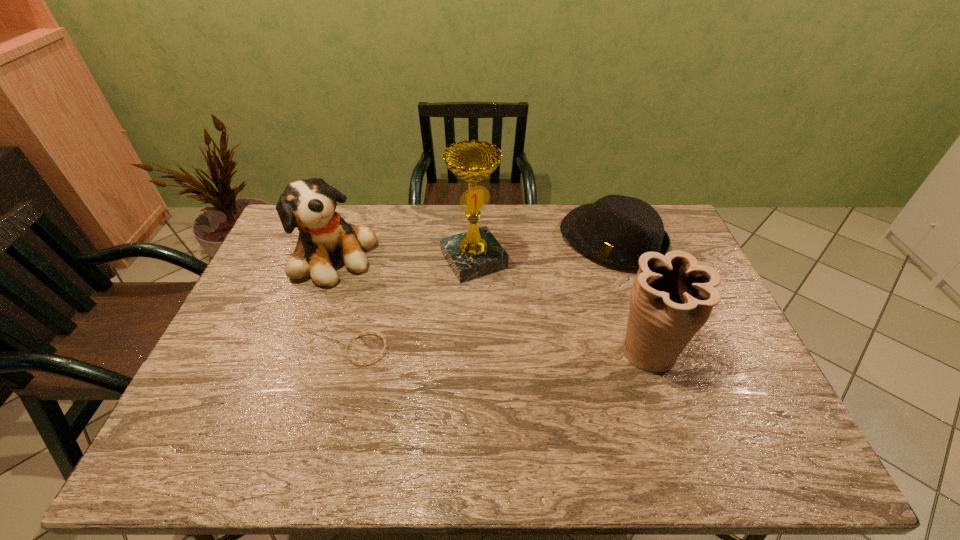
Locate an element on the screen. vacant point located 0.140m on the front-facing side of the third object from right to left is located at coordinates (508, 311).

The image size is (960, 540). Find the location of `free space located on the front-facing side of the third object from right to left`. free space located on the front-facing side of the third object from right to left is located at coordinates (528, 340).

The width and height of the screenshot is (960, 540). What are the coordinates of `free space located on the front-facing side of the third object from right to left` in the screenshot? It's located at (554, 379).

Find the location of a particular element. free space located on the front-facing side of the fedora is located at coordinates (527, 325).

Find the location of `vacant space positioned on the front-facing side of the fedora`. vacant space positioned on the front-facing side of the fedora is located at coordinates (548, 303).

In order to click on vacant space situated 0.220m on the front-facing side of the fedora in this screenshot , I will do `click(548, 303)`.

Locate an element on the screen. The image size is (960, 540). vacant space located at the face of the puppy is located at coordinates (406, 308).

Where is `blank space located 0.180m at the face of the puppy`? The width and height of the screenshot is (960, 540). blank space located 0.180m at the face of the puppy is located at coordinates (399, 303).

At what (x,y) coordinates should I click in order to perform the action: click on vacant space situated at the face of the puppy. Please return your answer as a coordinate pair (x, y). The image size is (960, 540). Looking at the image, I should click on (420, 318).

The image size is (960, 540). I want to click on award positioned at the far edge, so click(476, 253).